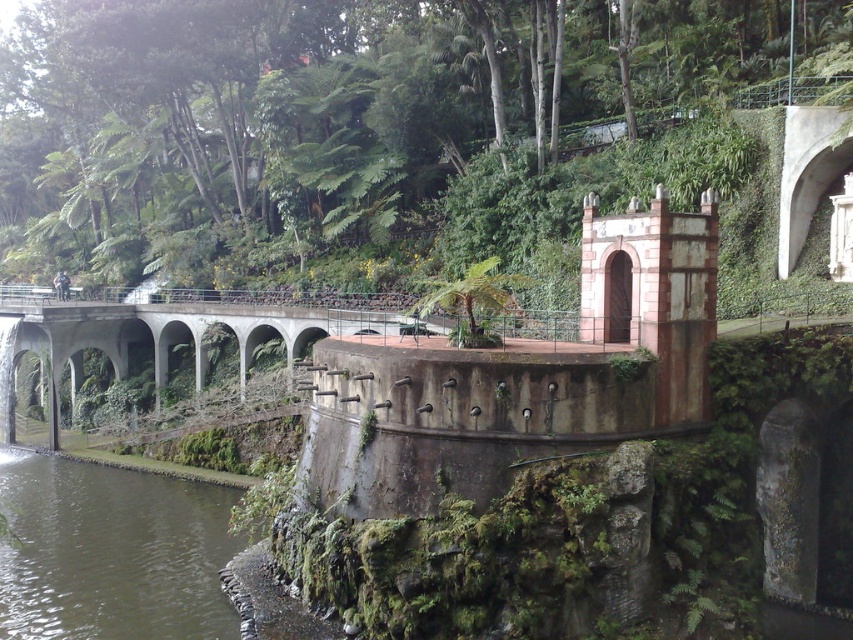
Can you confirm if green leafy vegetation at upper center is smaller than concrete bridge at center?

Actually, green leafy vegetation at upper center might be larger than concrete bridge at center.

Does green leafy vegetation at upper center appear on the left side of concrete bridge at center?

Correct, you'll find green leafy vegetation at upper center to the left of concrete bridge at center.

The image size is (853, 640). Find the location of `green leafy vegetation at upper center`. green leafy vegetation at upper center is located at coordinates (401, 134).

Which is above, green leafy vegetation at upper center or green mossy river at lower left?

green leafy vegetation at upper center

Is point (364, 205) less distant than point (173, 572)?

No, it is behind (173, 572).

Identify the location of green leafy vegetation at upper center. This screenshot has height=640, width=853. (401, 134).

Is point (21, 452) closer to viewer compared to point (303, 340)?

No, it is not.

Is green mossy river at lower left smaller than concrete bridge at center?

Yes.

Between point (223, 628) and point (49, 365), which one is positioned in front?

Point (223, 628)

The image size is (853, 640). In order to click on green mossy river at lower left in this screenshot , I will do `click(111, 554)`.